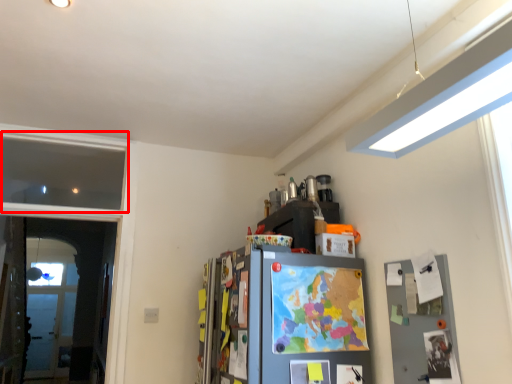
Question: From the image's perspective, what is the correct spatial positioning of window (annotated by the red box) in reference to screen door?

Choices:
 (A) below
 (B) above

Answer: (B)